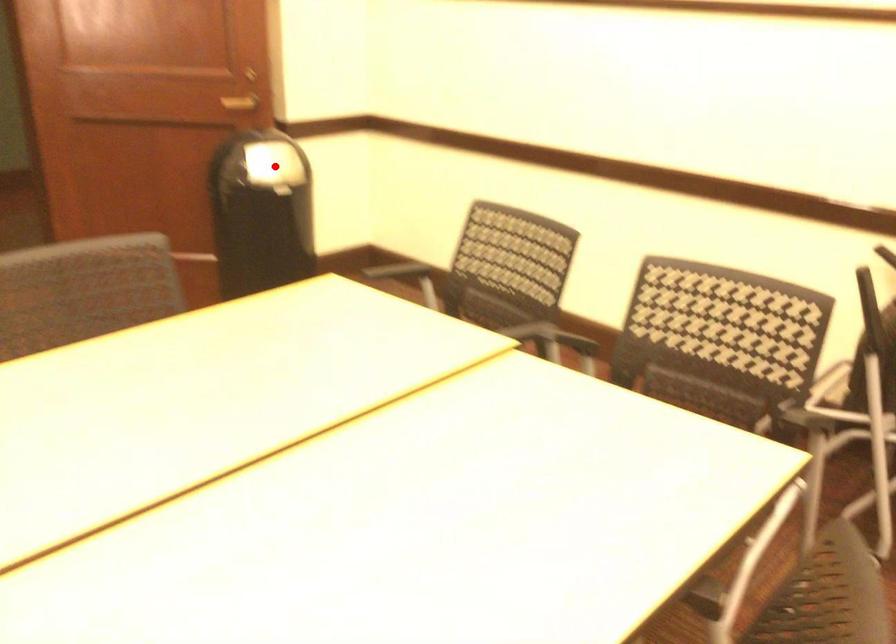
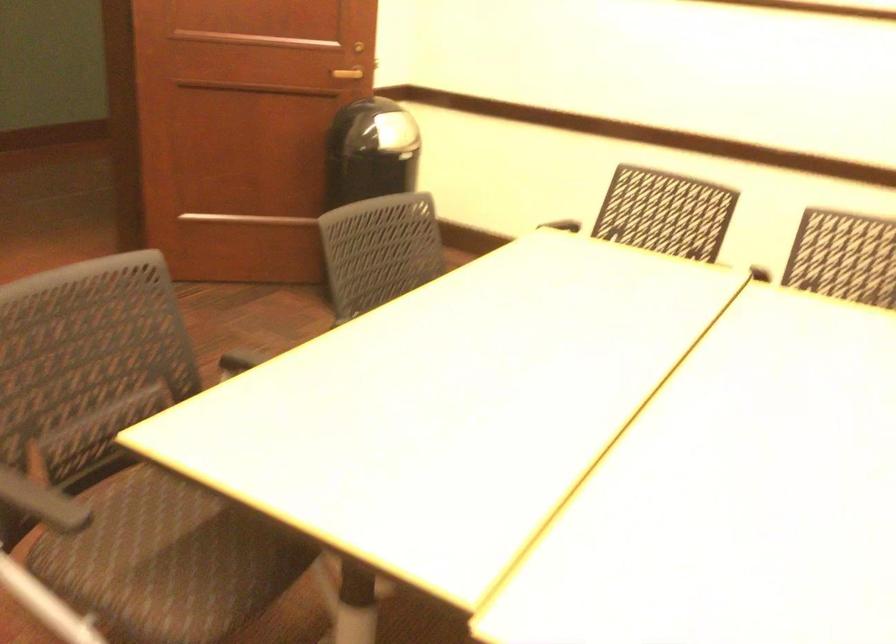
Question: I am providing you with two images of the same scene from different viewpoints. A red point is marked on the first image. At the location where the point appears in image 1, is it still visible in image 2?

Choices:
 (A) Yes
 (B) No

Answer: (B)